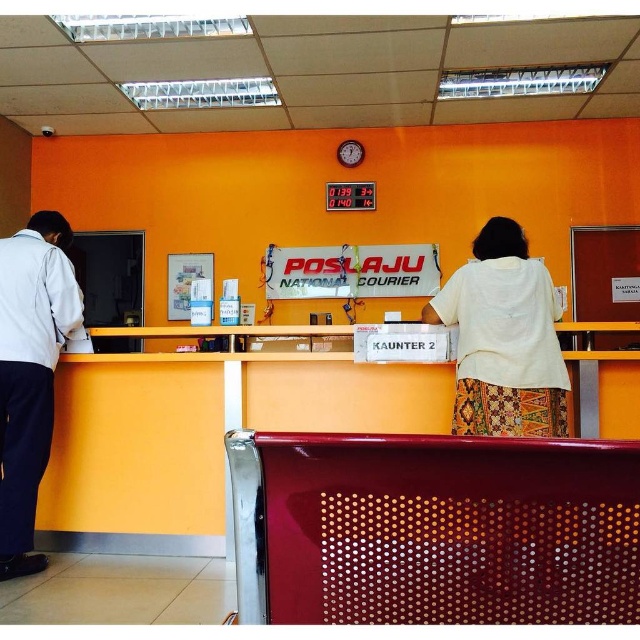
Question: Does yellow matte desk at left appear on the left side of white shirt at left?

Choices:
 (A) no
 (B) yes

Answer: (A)

Question: Which of these objects is positioned closest to the white fabric at center?

Choices:
 (A) yellow matte desk at left
 (B) white shirt at left

Answer: (A)

Question: Which point appears closest to the camera in this image?

Choices:
 (A) (45, 532)
 (B) (554, 406)

Answer: (B)

Question: Does yellow matte desk at left appear on the right side of white fabric at center?

Choices:
 (A) yes
 (B) no

Answer: (B)

Question: Is white fabric at center to the right of white shirt at left from the viewer's perspective?

Choices:
 (A) no
 (B) yes

Answer: (B)

Question: Among these points, which one is farthest from the camera?

Choices:
 (A) (486, 413)
 (B) (38, 368)

Answer: (B)